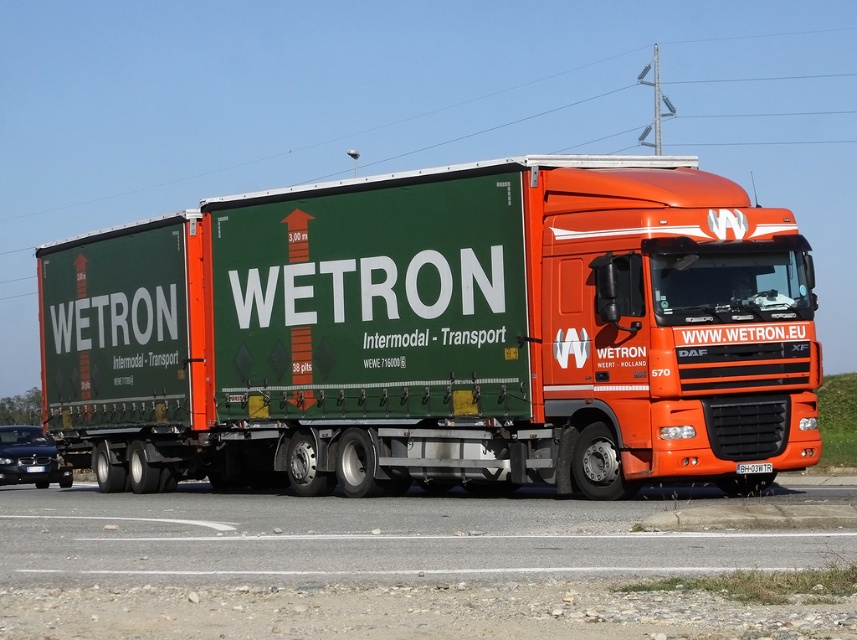
You are driving a large orange DAF XF 570 truck from Wetron and need to pass through a narrow alley. There is a shiny black sedan at lower left in the image. Can you safely navigate your truck around the sedan without hitting it?

The shiny black sedan at lower left is located at point (28,458), which is close to the lower left corner of the scene. Since the truck is on a paved road and the sedan is positioned near the edge, there should be enough space for the truck to maneuver around it safely as long as the driver takes appropriate precautions and maintains control.

You are a driver approaching the shiny black sedan at lower left and the red plastic license plate at center. Which object is bigger?

The shiny black sedan at lower left is larger in size than the red plastic license plate at center.

You are driving a delivery van and need to pass the shiny black sedan at lower left. The road is narrow, and there is a green fabric trailer truck at center parked ahead. Can you safely pass the sedan if your van is 6 meters long?

The green fabric trailer truck at center is 8.52 meters away from the shiny black sedan at lower left. Since your van is 6 meters long, you have enough space to safely pass the sedan as the distance between them is greater than your van length.